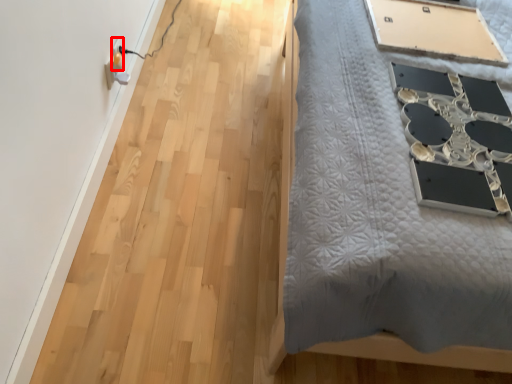
Question: Observing the image, what is the correct spatial positioning of electric outlet (annotated by the red box) in reference to table?

Choices:
 (A) right
 (B) left

Answer: (B)